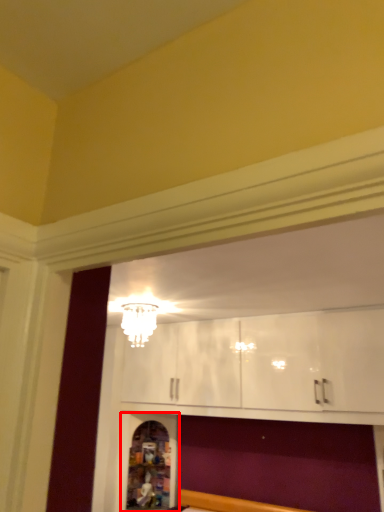
Question: From the image's perspective, where is shelf (annotated by the red box) located in relation to light fixture in the image?

Choices:
 (A) below
 (B) above

Answer: (A)